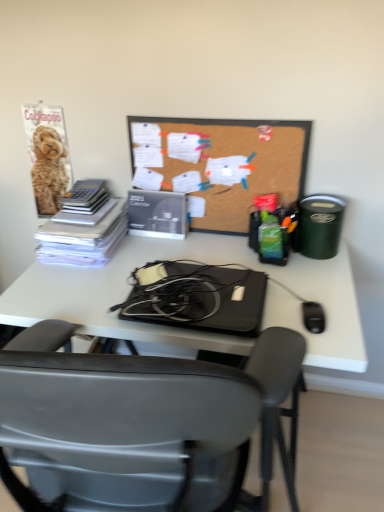
You are a GUI agent. You are given a task and a screenshot of the screen. Output one action in this format:
    pyautogui.click(x=<x>, y=<y>)
    Task: Click on the vacant region to the right of black matte laptop at center
    The height and width of the screenshot is (512, 384).
    Given the screenshot: What is the action you would take?
    pyautogui.click(x=310, y=298)